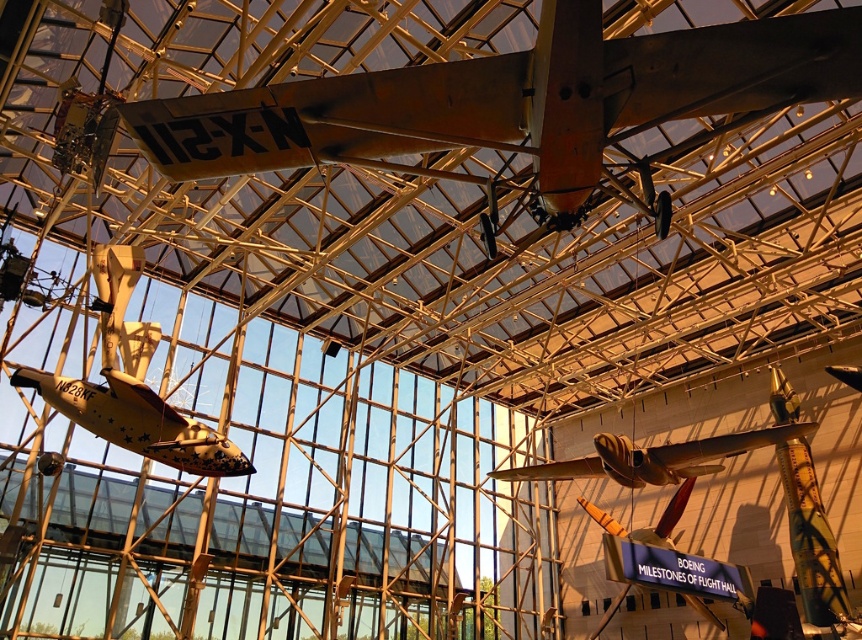
Which is more to the right, yellow matte airplane at center or shiny silver airplane at center?

From the viewer's perspective, shiny silver airplane at center appears more on the right side.

Which of these two, yellow matte airplane at center or shiny silver airplane at center, stands taller?

Standing taller between the two is shiny silver airplane at center.

Is point (159, 397) more distant than point (622, 468)?

No, (159, 397) is in front of (622, 468).

You are a GUI agent. You are given a task and a screenshot of the screen. Output one action in this format:
    pyautogui.click(x=<x>, y=<y>)
    Task: Click on the yellow matte airplane at center
    The width and height of the screenshot is (862, 640).
    Given the screenshot: What is the action you would take?
    pyautogui.click(x=132, y=385)

Does rusty metal airplane at upper center appear under yellow matte airplane at center?

Actually, rusty metal airplane at upper center is above yellow matte airplane at center.

Can you confirm if rusty metal airplane at upper center is taller than yellow matte airplane at center?

In fact, rusty metal airplane at upper center may be shorter than yellow matte airplane at center.

Is point (771, 19) positioned after point (125, 301)?

No, (771, 19) is closer to viewer.

This screenshot has width=862, height=640. In order to click on rusty metal airplane at upper center in this screenshot , I will do 517,104.

Can you confirm if rusty metal airplane at upper center is thinner than shiny silver airplane at center?

Yes, rusty metal airplane at upper center is thinner than shiny silver airplane at center.

Is point (611, 99) in front of point (803, 552)?

Yes, it is.

Is point (806, 40) farther from viewer compared to point (619, 444)?

No, (806, 40) is in front of (619, 444).

The height and width of the screenshot is (640, 862). I want to click on rusty metal airplane at upper center, so click(517, 104).